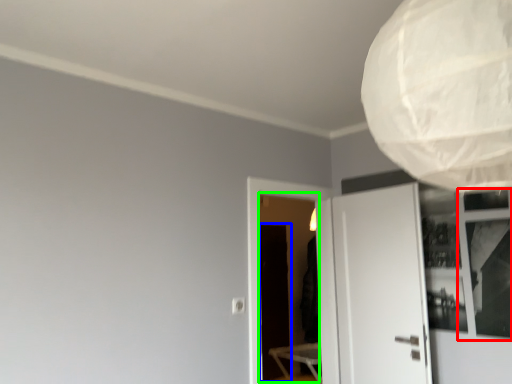
Question: Based on their relative distances, which object is farther from window (highlighted by a red box)? Choose from screen door (highlighted by a blue box) and screen door (highlighted by a green box).

Choices:
 (A) screen door
 (B) screen door

Answer: (B)